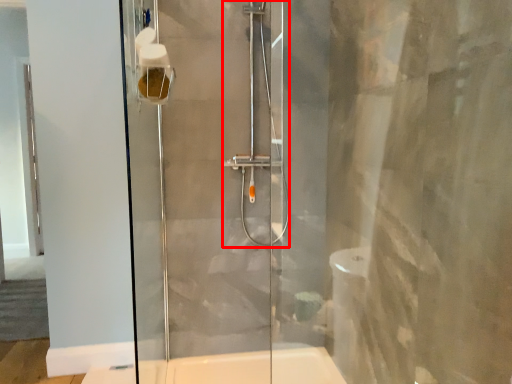
Question: Observing the image, what is the correct spatial positioning of shower (annotated by the red box) in reference to toilet paper?

Choices:
 (A) right
 (B) left

Answer: (A)